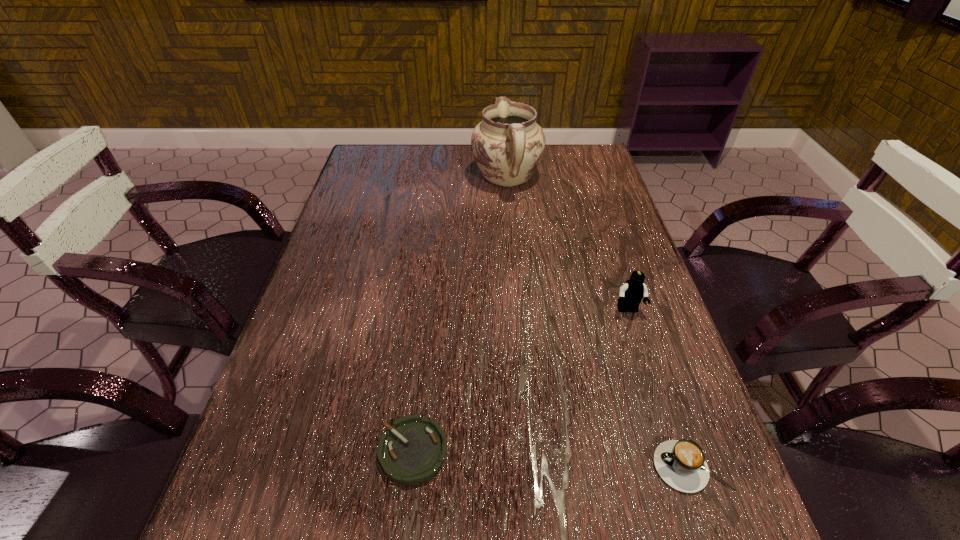
In order to click on the closest object to the shortest object in this screenshot , I will do `click(681, 464)`.